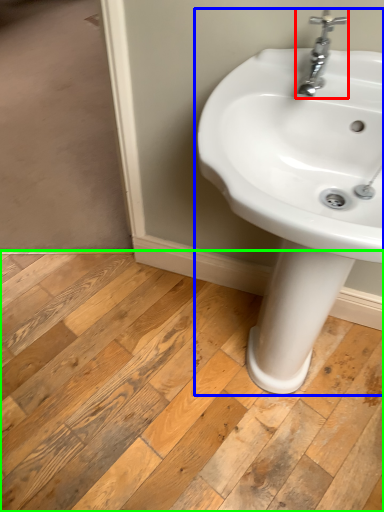
Question: Estimate the real-world distances between objects in this image. Which object is closer to tap (highlighted by a red box), sink (highlighted by a blue box) or plank (highlighted by a green box)?

Choices:
 (A) sink
 (B) plank

Answer: (A)